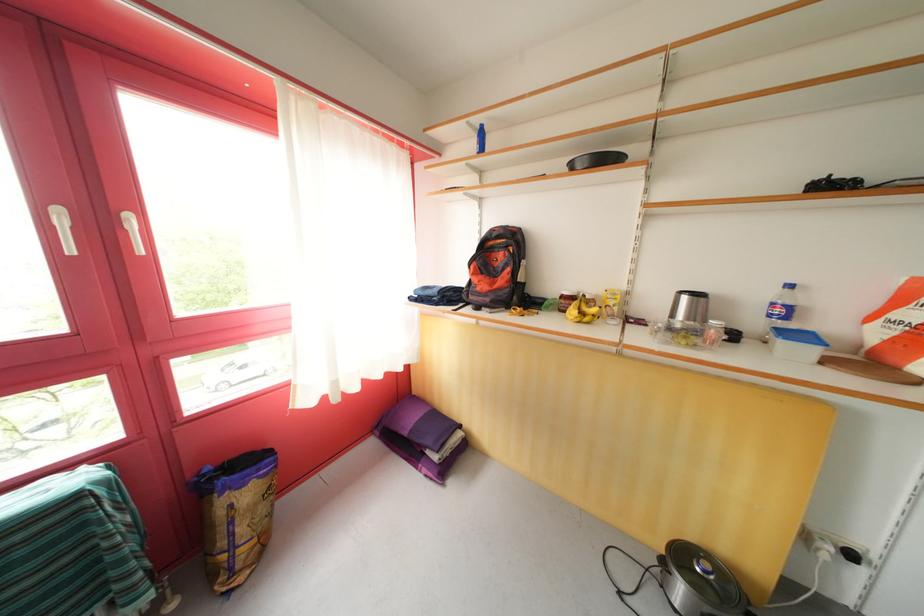
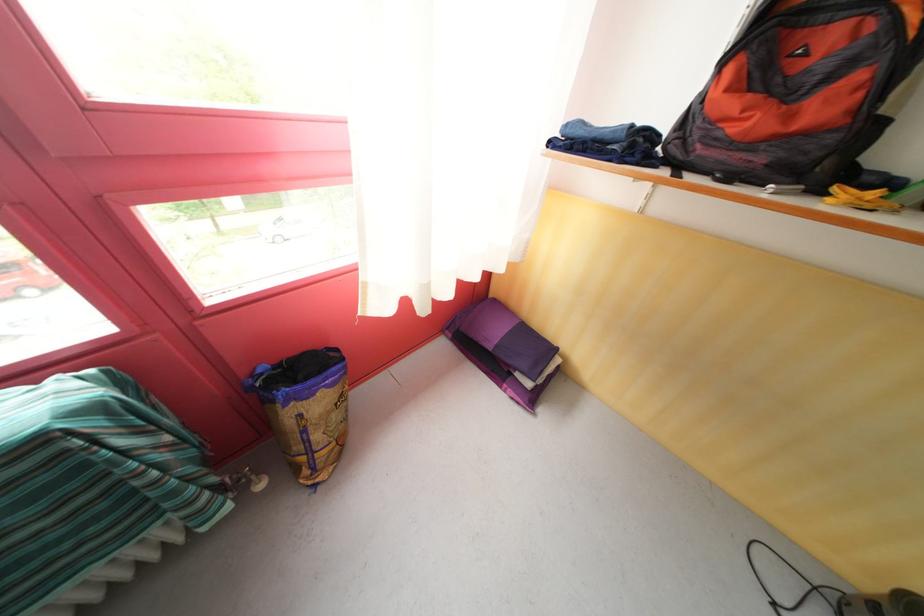
What movement of the cameraman would produce the second image?

The movement direction of the cameraman is left, forward.